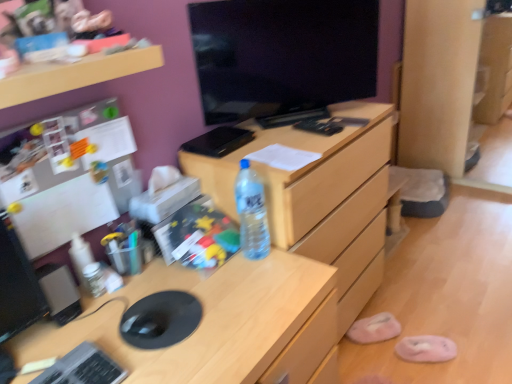
Where is `vacant area situated below black glossy monitor at center (from a real-world perspective)`? The image size is (512, 384). vacant area situated below black glossy monitor at center (from a real-world perspective) is located at coordinates (300, 113).